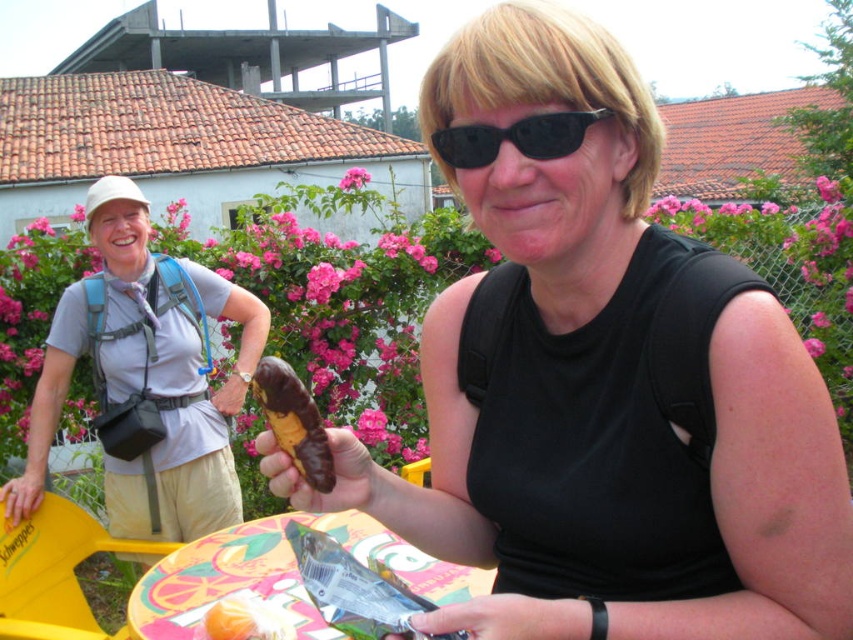
Question: Is gray fabric backpack at left bigger than black plastic sunglasses at center?

Choices:
 (A) no
 (B) yes

Answer: (B)

Question: Estimate the real-world distances between objects in this image. Which object is closer to the black plastic sunglasses at center?

Choices:
 (A) painted wood table at center
 (B) gray fabric backpack at left
 (C) pink petal at center
 (D) matte chocolate banana at center

Answer: (D)

Question: Which point is closer to the camera?

Choices:
 (A) gray fabric backpack at left
 (B) black plastic sunglasses at center
 (C) painted wood table at center
 (D) pink petal at center

Answer: (B)

Question: Observing the image, what is the correct spatial positioning of gray fabric backpack at left in reference to black plastic sunglasses at center?

Choices:
 (A) above
 (B) below

Answer: (B)

Question: Does gray fabric backpack at left have a smaller size compared to chocolate-coated banana at center?

Choices:
 (A) yes
 (B) no

Answer: (B)

Question: Which point is farther to the camera?

Choices:
 (A) matte chocolate banana at center
 (B) painted wood table at center

Answer: (B)